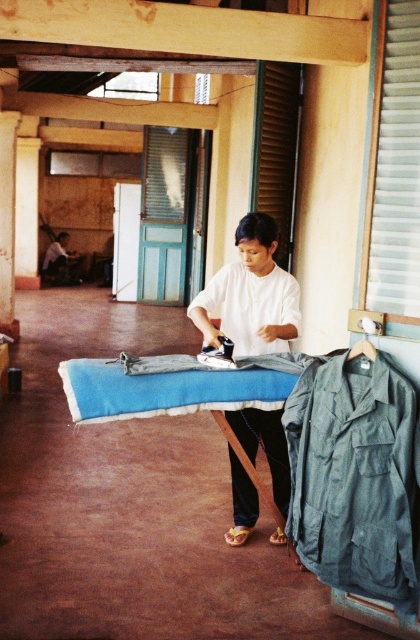
You are standing in the communal space and want to place a small plant pot at the point labeled as point [249,294]. Is this point located on the white matte shirt at center?

Yes, the point [249,294] is on the white matte shirt at center, so placing the plant pot there would be on the shirt.

You are organizing a laundry room and see the white matte shirt at center and the dark blue shirt at center. Which shirt is located lower in the image?

The white matte shirt at center is positioned under the dark blue shirt at center, so it is lower in the image.